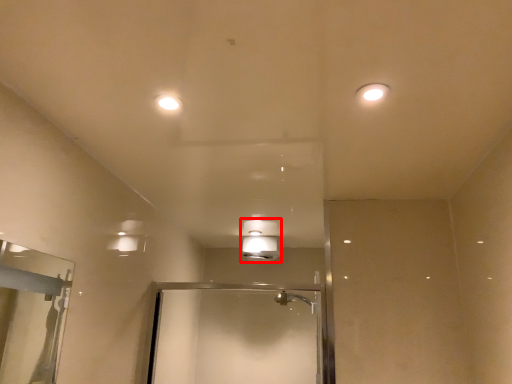
Question: Considering the relative positions of light fixture (annotated by the red box) and light fixture in the image provided, where is light fixture (annotated by the red box) located with respect to the staircase?

Choices:
 (A) left
 (B) right

Answer: (A)